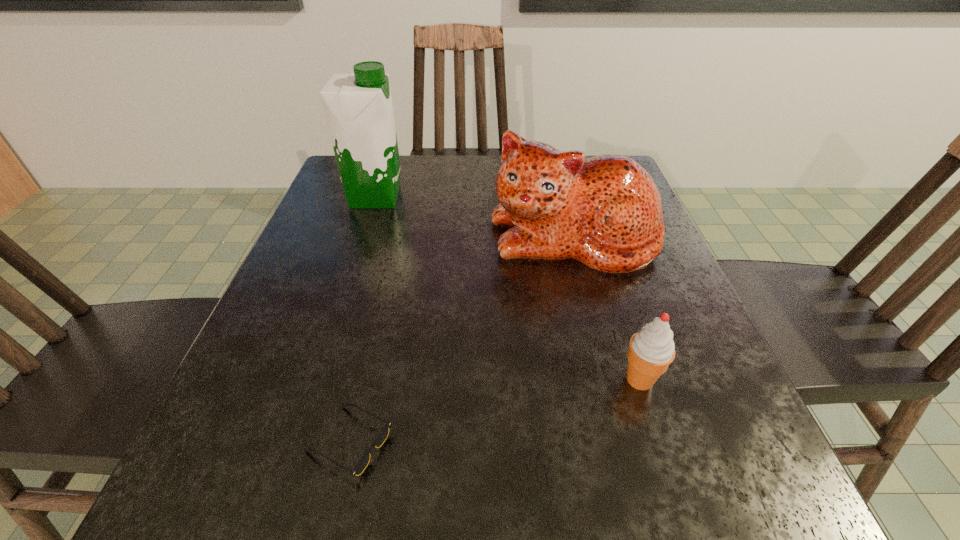
Locate an element on the screen. soya milk is located at coordinates (358, 106).

The width and height of the screenshot is (960, 540). I want to click on cat, so click(605, 211).

You are a GUI agent. You are given a task and a screenshot of the screen. Output one action in this format:
    pyautogui.click(x=<x>, y=<y>)
    Task: Click on the second shortest object
    The height and width of the screenshot is (540, 960).
    Given the screenshot: What is the action you would take?
    pyautogui.click(x=652, y=349)

Locate an element on the screen. The image size is (960, 540). icecream is located at coordinates (652, 349).

Locate an element on the screen. the nearest object is located at coordinates point(380,439).

Identify the location of the shortest object. The image size is (960, 540). (380, 439).

The image size is (960, 540). I want to click on free space located on the front-facing side of the tallest object, so click(525, 197).

You are a GUI agent. You are given a task and a screenshot of the screen. Output one action in this format:
    pyautogui.click(x=<x>, y=<y>)
    Task: Click on the vacant region located 0.360m on the face of the third shortest object
    This screenshot has width=960, height=540.
    Given the screenshot: What is the action you would take?
    pyautogui.click(x=631, y=460)

The height and width of the screenshot is (540, 960). I want to click on free space located on the left of the icecream, so click(x=388, y=380).

Find the location of a particular element. free spot located 0.160m on the lenses of the shortest object is located at coordinates (511, 442).